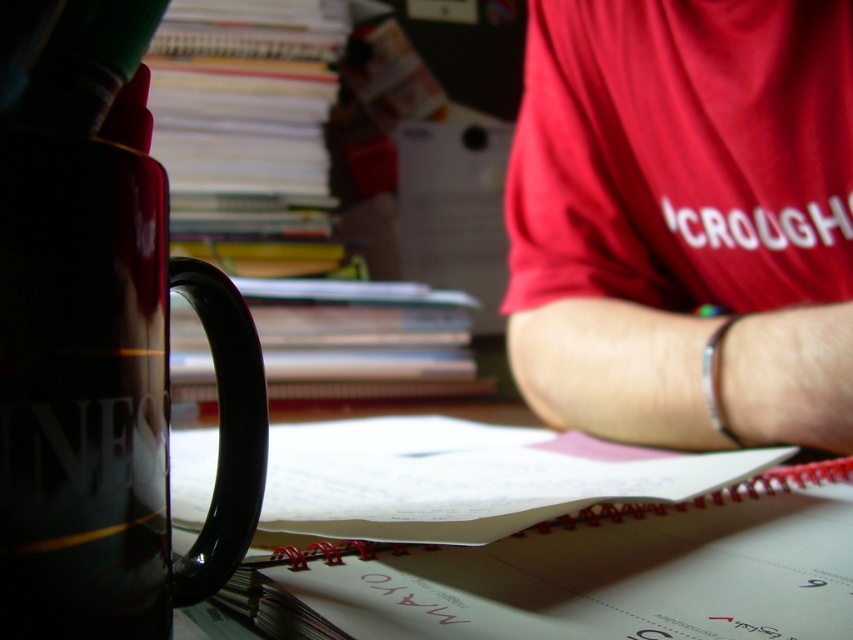
Question: Is matte red shirt at upper right bigger than shiny black mug at left?

Choices:
 (A) yes
 (B) no

Answer: (A)

Question: Among these objects, which one is farthest from the camera?

Choices:
 (A) spiral-bound notebook at center
 (B) shiny black mug at left

Answer: (A)

Question: Is matte red shirt at upper right to the left of spiral-bound notebook at center from the viewer's perspective?

Choices:
 (A) no
 (B) yes

Answer: (A)

Question: Among these objects, which one is farthest from the camera?

Choices:
 (A) matte red shirt at upper right
 (B) shiny black mug at left
 (C) spiral-bound notebook at center

Answer: (A)

Question: Is spiral-bound notebook at center wider than shiny black mug at left?

Choices:
 (A) no
 (B) yes

Answer: (B)

Question: Estimate the real-world distances between objects in this image. Which object is farther from the shiny black mug at left?

Choices:
 (A) matte red shirt at upper right
 (B) spiral-bound notebook at center

Answer: (A)